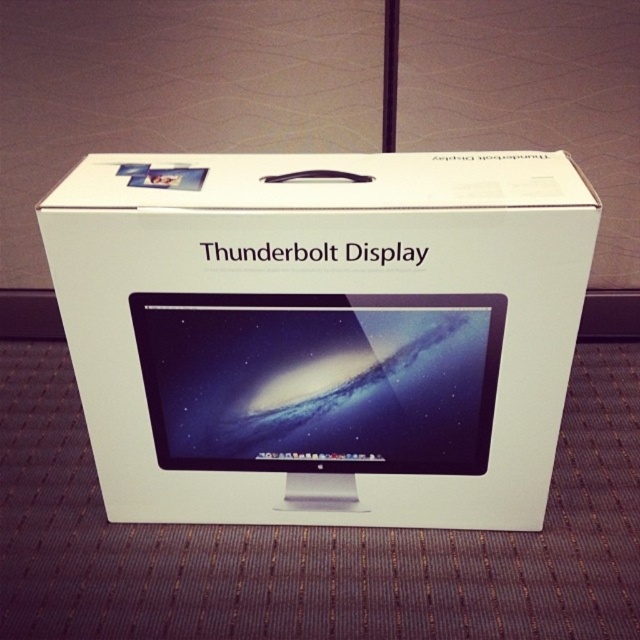
You are designing a promotional display for the Apple Thunderbolt Display. The display area has limited space. Given that the white matte cardboard box at center and the satin black monitor at center are 1.76 inches apart, can both items fit side by side without overlapping?

The white matte cardboard box at center and the satin black monitor at center are 1.76 inches apart, so they can fit side by side without overlapping as there is sufficient space between them.

You are an Apple store employee arranging items on a shelf. You have a white matte cardboard box at center and a satin black monitor at center. According to the image, where should you place the white matte cardboard box relative to the satin black monitor?

The white matte cardboard box at center should be placed to the right of the satin black monitor at center as per the image.